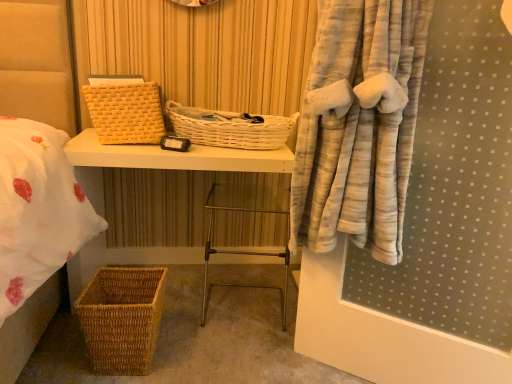
Where is `vacant area situated below woven wicker basket at lower left (from a real-world perspective)`? vacant area situated below woven wicker basket at lower left (from a real-world perspective) is located at coordinates (201, 283).